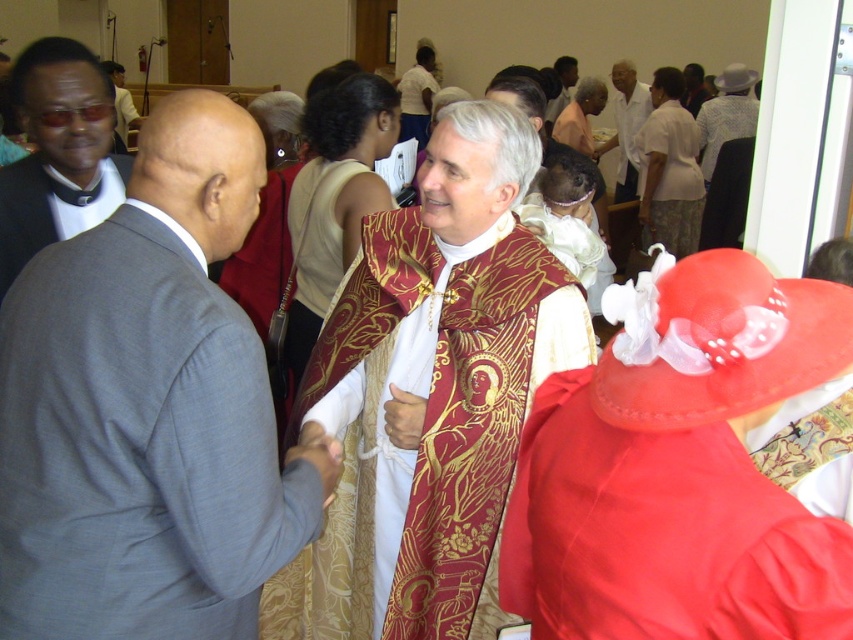
Can you confirm if gray suit at left is smaller than white silk shirt at upper right?

Yes.

Who is positioned more to the right, gray suit at left or white silk shirt at upper right?

white silk shirt at upper right

Is point (137, 264) farther from camera compared to point (630, 88)?

No, it is not.

Find the location of a particular element. This screenshot has height=640, width=853. gray suit at left is located at coordinates (148, 410).

From the picture: Is gold embroidered vestment at center taller than matte black suit at left?

Indeed, gold embroidered vestment at center has a greater height compared to matte black suit at left.

Who is taller, gold embroidered vestment at center or matte black suit at left?

Standing taller between the two is gold embroidered vestment at center.

The image size is (853, 640). I want to click on gold embroidered vestment at center, so click(432, 392).

Can you confirm if gold embroidered vestment at center is positioned to the right of white silk shirt at upper right?

In fact, gold embroidered vestment at center is to the left of white silk shirt at upper right.

Is point (428, 458) farther from camera compared to point (631, 106)?

No, it is not.

The width and height of the screenshot is (853, 640). I want to click on gold embroidered vestment at center, so click(x=432, y=392).